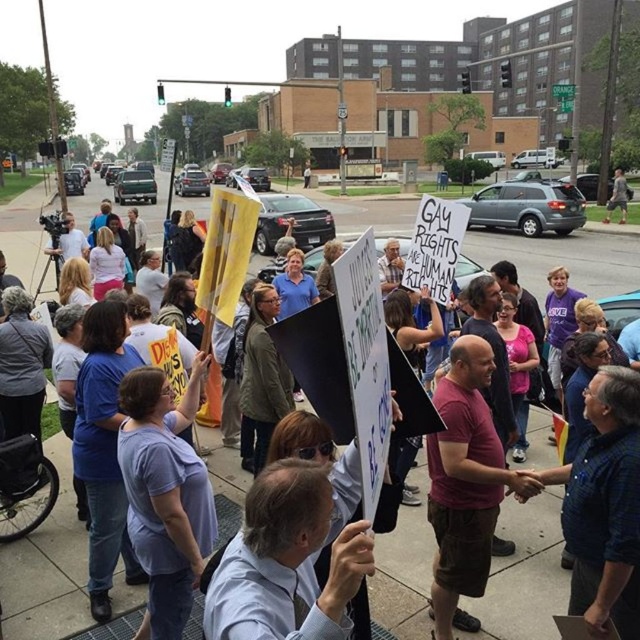
Who is taller, concrete sidewalk at center or light purple t-shirt at center?

concrete sidewalk at center is taller.

Is concrete sidewalk at center thinner than light purple t-shirt at center?

No, concrete sidewalk at center is not thinner than light purple t-shirt at center.

Who is more distant from viewer, (358, 204) or (189, 464)?

Point (358, 204)

Where is `concrete sidewalk at center`? concrete sidewalk at center is located at coordinates (48, 566).